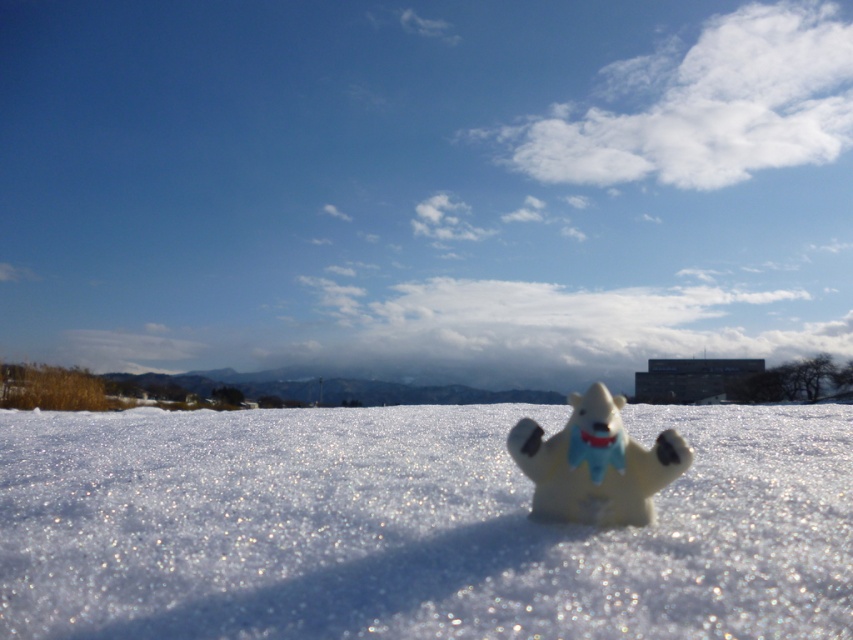
Measure the distance between white fluffy snow at center and white matte polar bear at center.

white fluffy snow at center is 52.42 centimeters away from white matte polar bear at center.

Is white fluffy snow at center shorter than white matte polar bear at center?

Incorrect, white fluffy snow at center's height does not fall short of white matte polar bear at center's.

You are a GUI agent. You are given a task and a screenshot of the screen. Output one action in this format:
    pyautogui.click(x=<x>, y=<y>)
    Task: Click on the white fluffy snow at center
    The height and width of the screenshot is (640, 853).
    Given the screenshot: What is the action you would take?
    pyautogui.click(x=412, y=525)

Where is `white fluffy snow at center`? This screenshot has width=853, height=640. white fluffy snow at center is located at coordinates point(412,525).